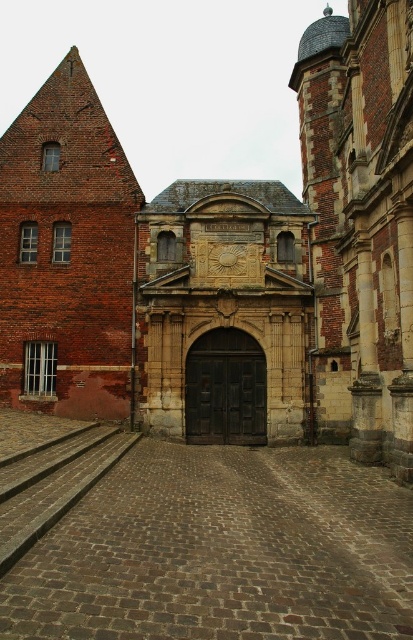
Question: Is brown cobblestone train track at center wider than gray concrete steps at lower left?

Choices:
 (A) yes
 (B) no

Answer: (A)

Question: Is brown cobblestone train track at center below brick wall at left?

Choices:
 (A) yes
 (B) no

Answer: (A)

Question: Which is nearer to the gray concrete steps at lower left?

Choices:
 (A) brown cobblestone train track at center
 (B) stone carved gate at center

Answer: (A)

Question: Considering the real-world distances, which object is closest to the brown cobblestone train track at center?

Choices:
 (A) gray concrete steps at lower left
 (B) stone carved gate at center

Answer: (A)

Question: Does brown cobblestone train track at center come in front of brick wall at left?

Choices:
 (A) yes
 (B) no

Answer: (A)

Question: Among these points, which one is farthest from the camera?

Choices:
 (A) click(x=211, y=538)
 (B) click(x=9, y=548)
 (C) click(x=26, y=230)

Answer: (C)